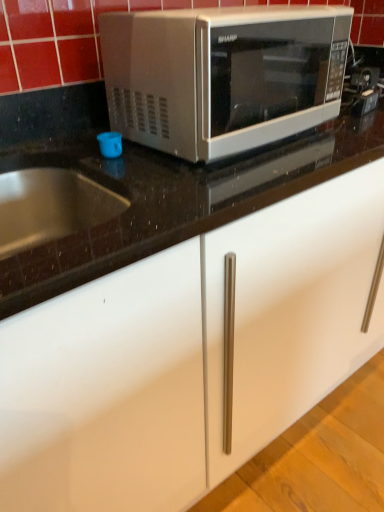
Find the location of `satin silver microwave at upper center`. satin silver microwave at upper center is located at coordinates (222, 76).

The image size is (384, 512). What do you see at coordinates (222, 76) in the screenshot? I see `satin silver microwave at upper center` at bounding box center [222, 76].

In order to click on satin silver microwave at upper center in this screenshot , I will do `click(222, 76)`.